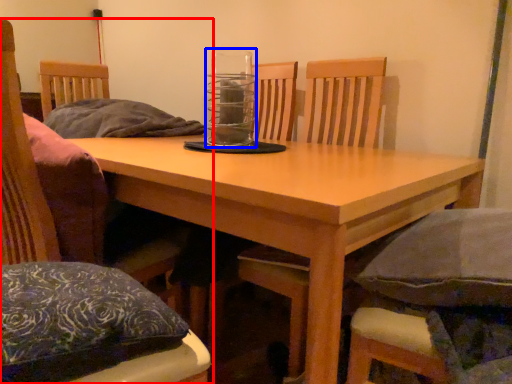
Question: Which of the following is the farthest to the observer, chair (highlighted by a red box) or glass jar (highlighted by a blue box)?

Choices:
 (A) chair
 (B) glass jar

Answer: (B)